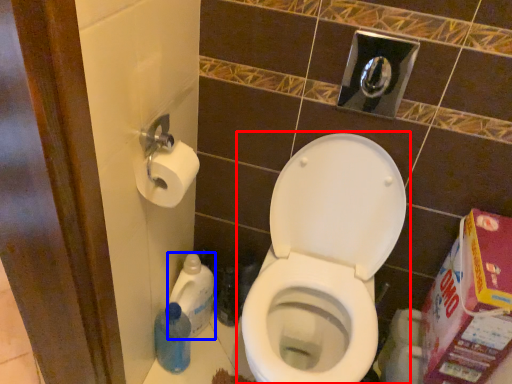
Question: Which object appears farthest to the camera in this image, toilet (highlighted by a red box) or cleaning product (highlighted by a blue box)?

Choices:
 (A) toilet
 (B) cleaning product

Answer: (B)